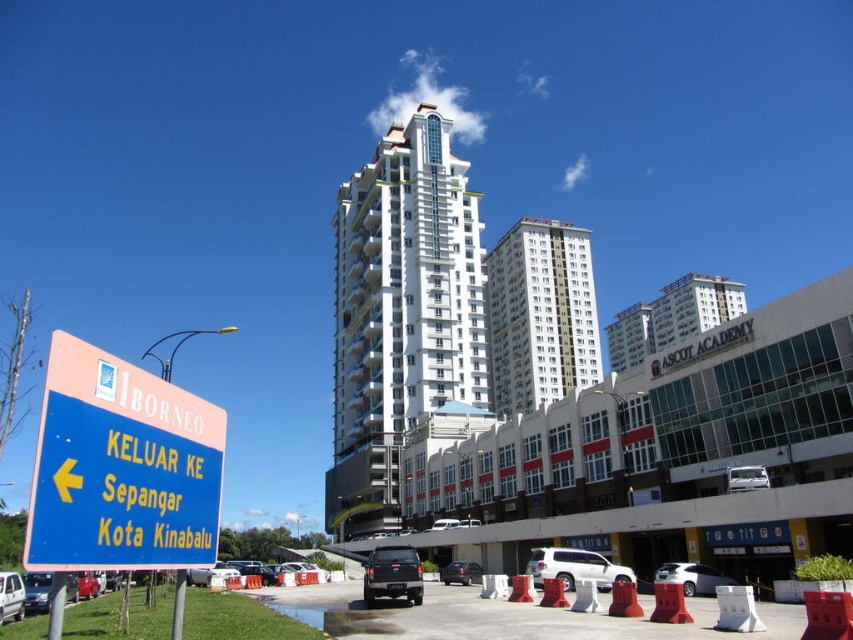
You are a delivery driver who needs to park your silver metallic sedan at lower center in a designated parking spot located at coordinates 0.903, 0.812. Is your current position aligned with the parking spot?

The silver metallic sedan at lower center is already positioned at point (692, 577), so it is correctly aligned with the parking spot.

You are standing at the road sign and want to walk towards the building labeled ASC. Which of the two points, point (813, 358) or point (727, 468), is closer to you as you face the building?

Point (813, 358) is closer to the viewer than point (727, 468), so it is the closer point when facing the building labeled ASC.